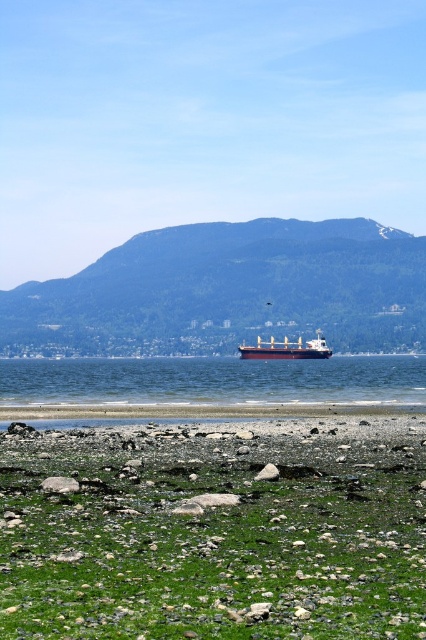
Question: Which object is positioned closest to the blue water at center?

Choices:
 (A) green forested mountain at center
 (B) white matte cargo ship at center

Answer: (B)

Question: Is green mossy rocks at lower center wider than green forested mountain at center?

Choices:
 (A) yes
 (B) no

Answer: (B)

Question: Does green forested mountain at center have a larger size compared to white matte cargo ship at center?

Choices:
 (A) yes
 (B) no

Answer: (A)

Question: Which of the following is the farthest from the observer?

Choices:
 (A) (213, 244)
 (B) (48, 612)
 (C) (287, 356)

Answer: (A)

Question: Which point is farther to the camera?

Choices:
 (A) green forested mountain at center
 (B) green mossy rocks at lower center
 (C) blue water at center
 (D) white matte cargo ship at center

Answer: (A)

Question: Considering the relative positions of green forested mountain at center and white matte cargo ship at center in the image provided, where is green forested mountain at center located with respect to white matte cargo ship at center?

Choices:
 (A) below
 (B) above

Answer: (B)